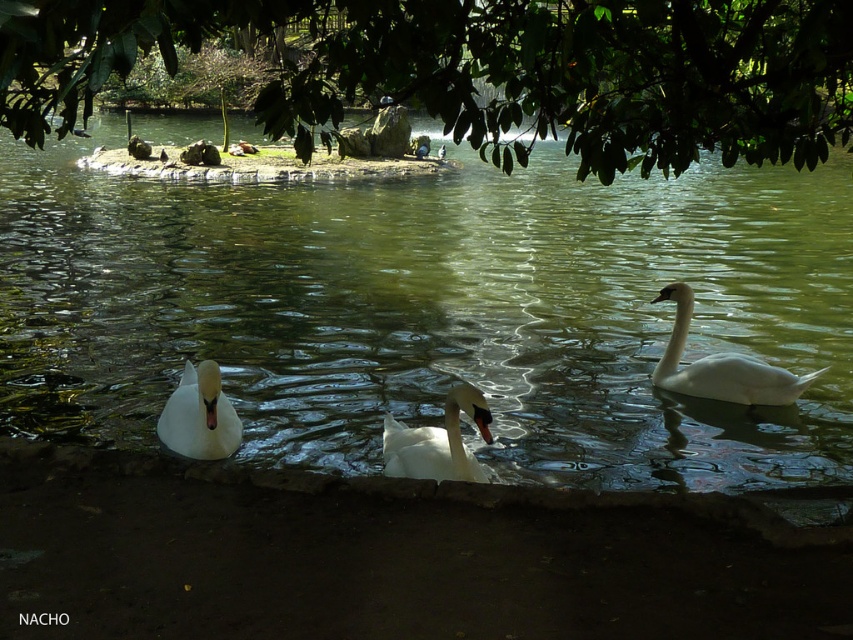
Question: Which point appears closest to the camera in this image?

Choices:
 (A) (9, 4)
 (B) (215, 372)
 (C) (705, 392)
 (D) (358, 400)

Answer: (A)

Question: Does green leafy tree at upper center appear on the left side of white glossy swan at center?

Choices:
 (A) no
 (B) yes

Answer: (B)

Question: Among these points, which one is nearest to the camera?

Choices:
 (A) (579, 145)
 (B) (421, 461)
 (C) (207, 401)
 (D) (744, 369)

Answer: (B)

Question: Does clear water at center appear on the right side of white glossy swan at center?

Choices:
 (A) no
 (B) yes

Answer: (A)

Question: Can you confirm if clear water at center is bigger than green leafy tree at upper center?

Choices:
 (A) yes
 (B) no

Answer: (A)

Question: Which object appears closest to the camera in this image?

Choices:
 (A) white glossy swan at center
 (B) white glossy swan at lower left

Answer: (A)